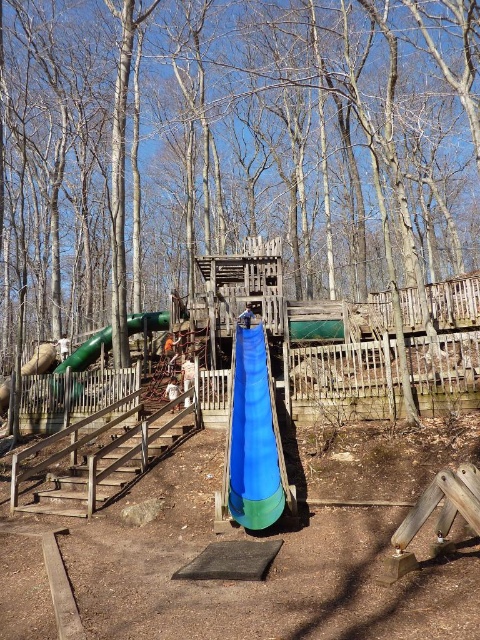
You are a parent supervising children at the playground. You notice the green wood tree at center and the white fabric at center. Which object would block more sunlight if you stand directly under it?

The green wood tree at center has a larger size compared to the white fabric at center, so it would block more sunlight when standing directly under it.

You are a parent trying to decide where to let your child play safely. You see the green wood tree at center and the blue fabric slide at center. Which object is wider and might provide more space for your child to move around?

The green wood tree at center is wider than the blue fabric slide at center, so it might provide more space for your child to move around.